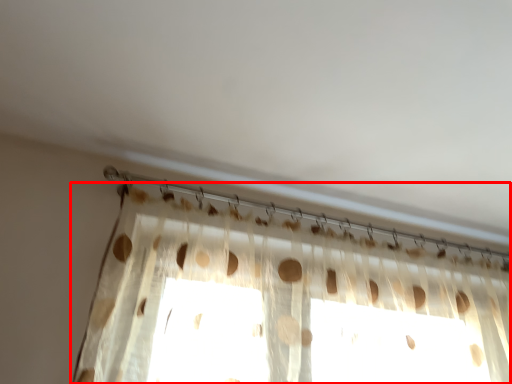
Question: Considering the relative positions of curtain (annotated by the red box) and clothesline in the image provided, where is curtain (annotated by the red box) located with respect to the staircase?

Choices:
 (A) left
 (B) right

Answer: (B)